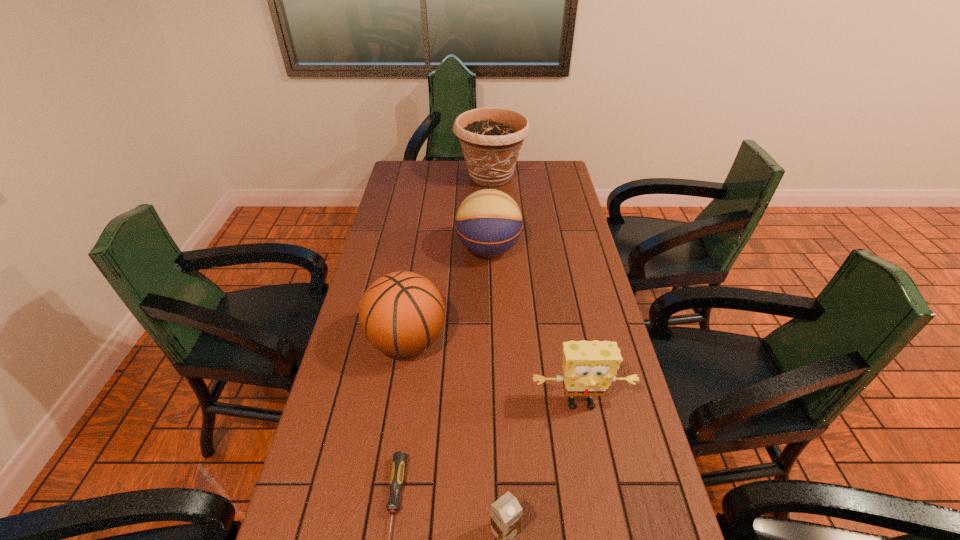
You are a GUI agent. You are given a task and a screenshot of the screen. Output one action in this format:
    pyautogui.click(x=<x>, y=<y>)
    Task: Click on the vacant space located 0.170m on the front of the third farthest object
    Image resolution: width=960 pixels, height=540 pixels.
    Given the screenshot: What is the action you would take?
    pyautogui.click(x=393, y=431)

Where is `free space located 0.080m on the face of the sponge`? Image resolution: width=960 pixels, height=540 pixels. free space located 0.080m on the face of the sponge is located at coordinates (589, 450).

At what (x,y) coordinates should I click in order to perform the action: click on object present at the far edge. Please return your answer as a coordinate pair (x, y). This screenshot has width=960, height=540. Looking at the image, I should click on (491, 138).

Locate an element on the screen. This screenshot has width=960, height=540. object that is at the left edge is located at coordinates (402, 313).

Find the location of `object that is at the right edge`. object that is at the right edge is located at coordinates (589, 367).

Where is `vacant space at the far edge of the desktop`? The width and height of the screenshot is (960, 540). vacant space at the far edge of the desktop is located at coordinates click(x=466, y=165).

Where is `vacant space at the left edge`? vacant space at the left edge is located at coordinates (381, 409).

Identify the location of free space at the right edge of the desktop. (558, 275).

Identify the location of vacant space at the far left corner of the desktop. (396, 163).

This screenshot has height=540, width=960. I want to click on blank space at the far right corner, so click(x=540, y=164).